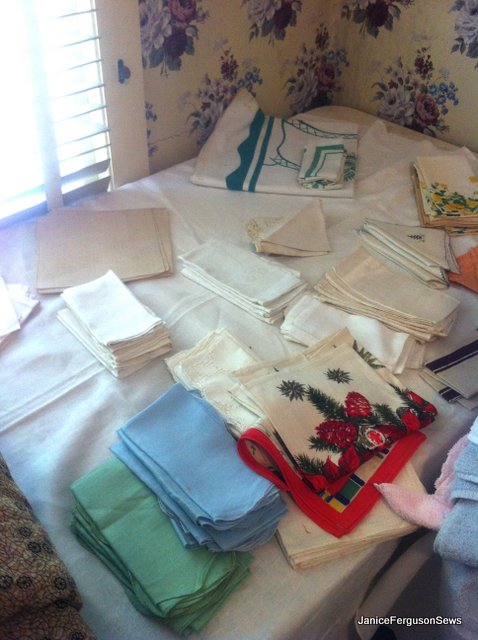
Find the location of `blinds`. blinds is located at coordinates (94, 132).